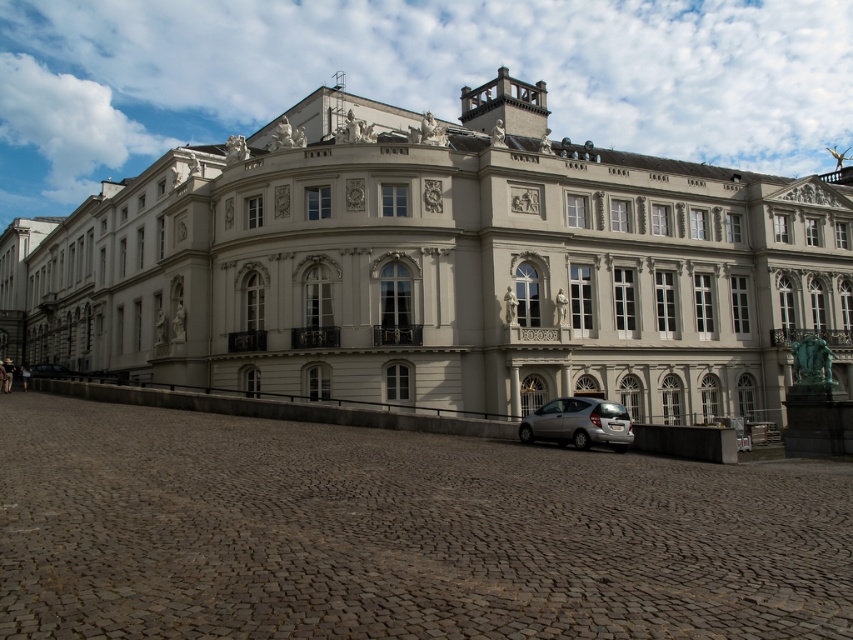
You are standing at the coordinates 0.3, 0.5. Which direction should you move to reach the white stone building at center?

Since the white stone building at center is located at point (439, 268) and you are at (426, 192), you should move to the right and slightly upwards to reach it.

You are a photographer standing on the cobblestone pavement in front of the white stone building at center. You want to take a photo of the silver metallic hatchback at lower center without the building blocking the view. Is it possible to position yourself in such a way that the hatchback is visible while the building is not in the frame?

The white stone building at center is located above the silver metallic hatchback at lower center, so yes, you can position yourself lower or move to the side to capture the hatchback without the building obstructing the view.

You are standing in front of the grand classical building. There is a point marked at coordinates (439, 268). Based on the scene description, can you determine where this point is located relative to the building?

The point at coordinates (439, 268) is on the white stone building at center.